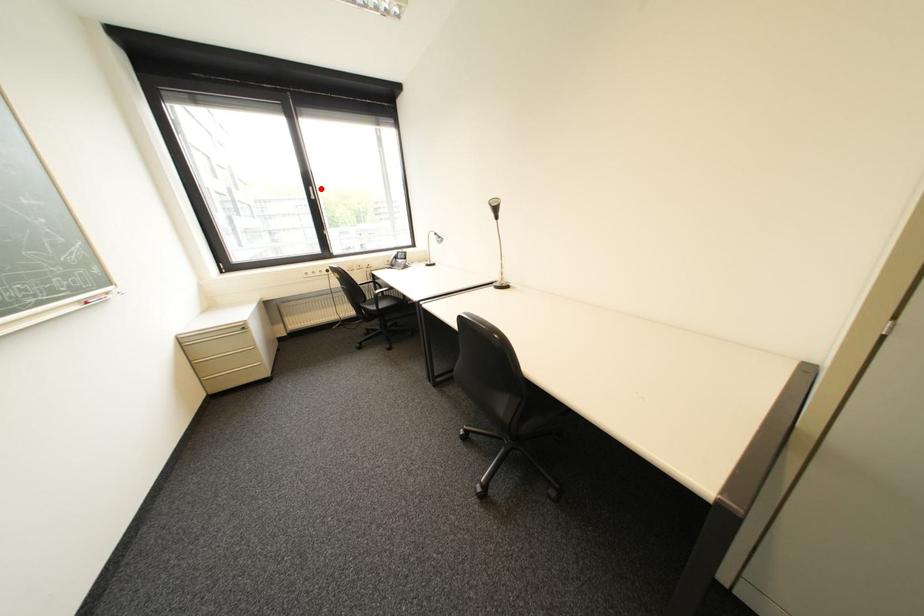
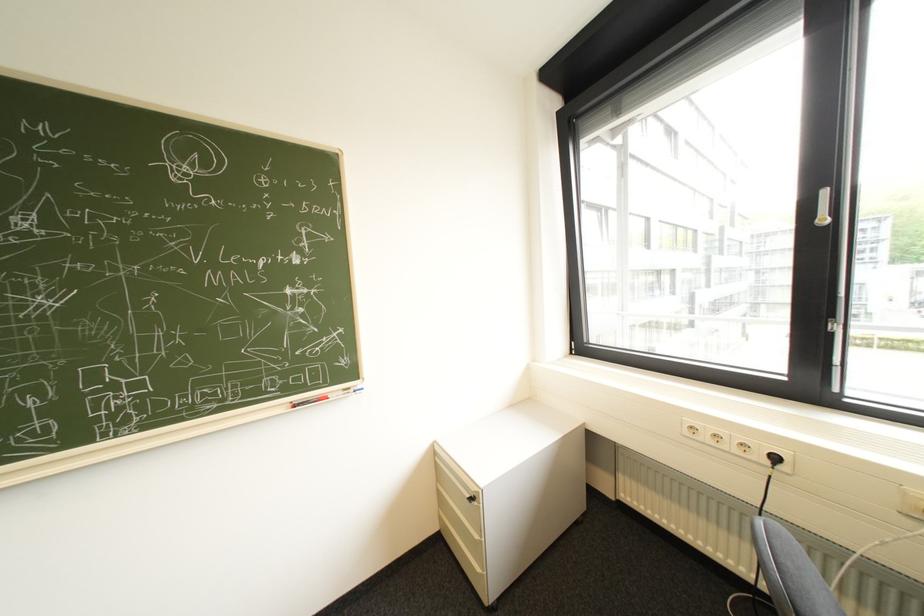
Locate, in the second image, the point that corresponds to the highlighted location in the first image.

(834, 193)